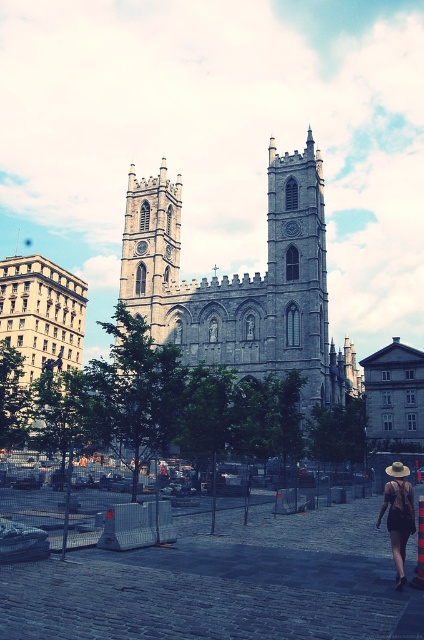
You are a photographer planning to take a picture of the gray stone church at center and the matte black dress at lower right. Which object should you focus on first if you want to capture both in a single frame without moving the camera?

You should focus on the gray stone church at center first since it is wider than the matte black dress at lower right, ensuring it fits within the frame properly before adjusting for the smaller object.

You are standing in the plaza in front of the gray stone church at center and the gray stone church at left. Which church appears taller from your vantage point?

The gray stone church at center appears taller than the gray stone church at left from your vantage point because it has a greater height compared to the gray stone church at left.